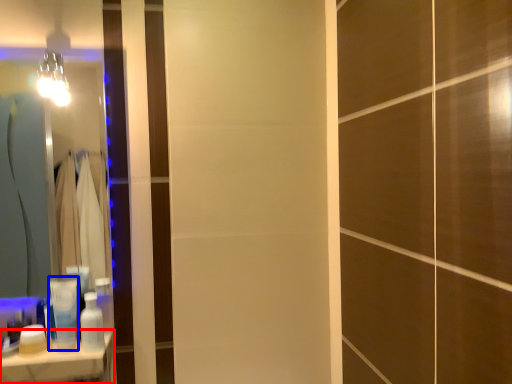
Question: Which point is closer to the camera, counter top (highlighted by a red box) or toiletry (highlighted by a blue box)?

Choices:
 (A) counter top
 (B) toiletry

Answer: (A)